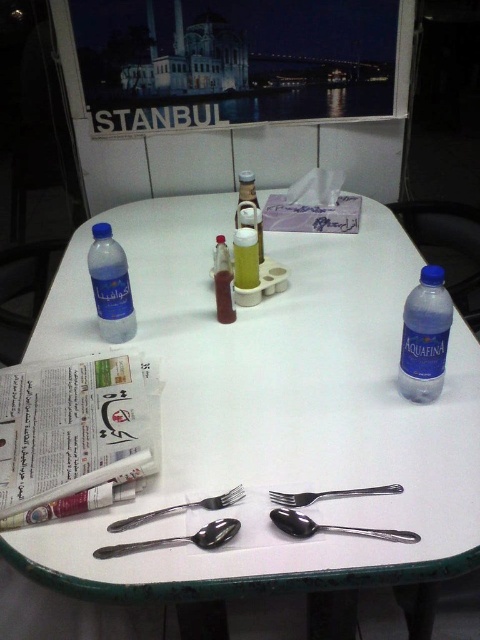
Between translucent plastic bottle at center and silver metallic fork at center, which one has more height?

translucent plastic bottle at center

Does translucent plastic bottle at center have a lesser width compared to silver metallic fork at center?

Correct, translucent plastic bottle at center's width is less than silver metallic fork at center's.

Is point (225, 246) farther from camera compared to point (277, 493)?

Yes.

Find the location of `translucent plastic bottle at center`. translucent plastic bottle at center is located at coordinates (223, 282).

Does white plastic table at center have a larger size compared to shiny metallic fork at lower left?

Yes, white plastic table at center is bigger than shiny metallic fork at lower left.

Who is taller, white plastic table at center or shiny metallic fork at lower left?

white plastic table at center is taller.

You are a GUI agent. You are given a task and a screenshot of the screen. Output one action in this format:
    pyautogui.click(x=<x>, y=<y>)
    Task: Click on the white plastic table at center
    The width and height of the screenshot is (480, 640).
    Given the screenshot: What is the action you would take?
    pyautogui.click(x=274, y=410)

Does silver metallic spoon at center have a greater height compared to silver metallic fork at center?

Indeed, silver metallic spoon at center has a greater height compared to silver metallic fork at center.

Is point (143, 548) closer to camera compared to point (304, 500)?

Yes, point (143, 548) is closer to viewer.

You are a GUI agent. You are given a task and a screenshot of the screen. Output one action in this format:
    pyautogui.click(x=<x>, y=<y>)
    Task: Click on the silver metallic spoon at center
    This screenshot has width=480, height=640.
    Given the screenshot: What is the action you would take?
    pyautogui.click(x=179, y=540)

Locate an element on the screen. silver metallic spoon at center is located at coordinates (179, 540).